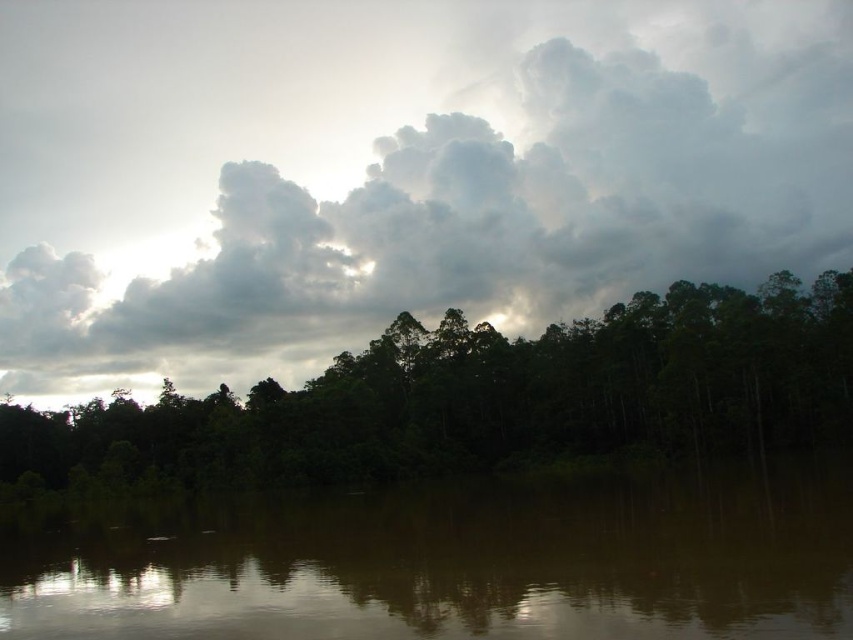
Does cloudy sky at upper center have a greater height compared to brown reflective water at center?

Yes, cloudy sky at upper center is taller than brown reflective water at center.

In the scene shown: Measure the distance between cloudy sky at upper center and camera.

A distance of 244.21 meters exists between cloudy sky at upper center and camera.

Locate an element on the screen. Image resolution: width=853 pixels, height=640 pixels. cloudy sky at upper center is located at coordinates (393, 172).

Between cloudy sky at upper center and dark green trees at center, which one appears on the left side from the viewer's perspective?

Positioned to the left is dark green trees at center.

How much distance is there between cloudy sky at upper center and dark green trees at center?

cloudy sky at upper center is 156.52 meters away from dark green trees at center.

Is point (308, 28) closer to camera compared to point (311, 417)?

No.

Image resolution: width=853 pixels, height=640 pixels. Identify the location of cloudy sky at upper center. (393, 172).

Is brown reflective water at center below dark green trees at center?

Correct, brown reflective water at center is located below dark green trees at center.

Can you confirm if brown reflective water at center is wider than dark green trees at center?

In fact, brown reflective water at center might be narrower than dark green trees at center.

Does point (183, 624) come in front of point (804, 419)?

Yes, it is.

At what (x,y) coordinates should I click in order to perform the action: click on brown reflective water at center. Please return your answer as a coordinate pair (x, y). The width and height of the screenshot is (853, 640). Looking at the image, I should click on (451, 563).